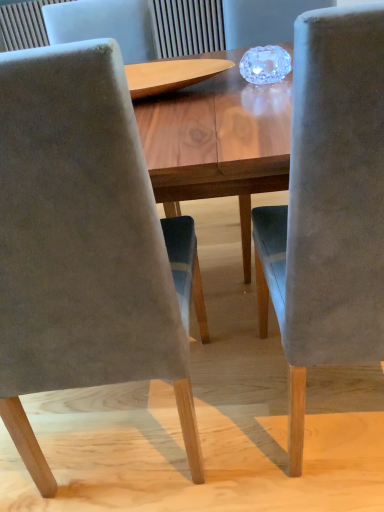
Where is `free region under velvet gray chair at right, which ranks as the first chair in right-to-left order (from a real-world perspective)`? free region under velvet gray chair at right, which ranks as the first chair in right-to-left order (from a real-world perspective) is located at coordinates (338, 416).